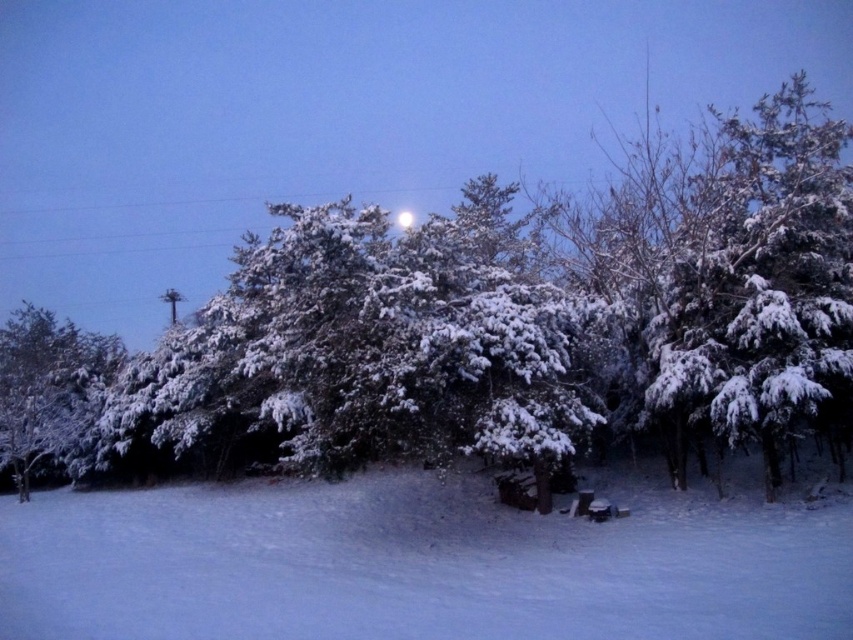
Question: Can you confirm if snow-covered evergreen at center is positioned to the left of white fluffy snow at lower center?

Choices:
 (A) no
 (B) yes

Answer: (A)

Question: Which point is farther from the camera taking this photo?

Choices:
 (A) [155, 566]
 (B) [782, 131]

Answer: (B)

Question: Which object is farther from the camera taking this photo?

Choices:
 (A) snow-covered evergreen at center
 (B) white fluffy snow at lower center

Answer: (A)

Question: Is snow-covered evergreen at center smaller than white fluffy snow at lower center?

Choices:
 (A) yes
 (B) no

Answer: (B)

Question: Does snow-covered evergreen at center appear over white fluffy snow at lower center?

Choices:
 (A) yes
 (B) no

Answer: (A)